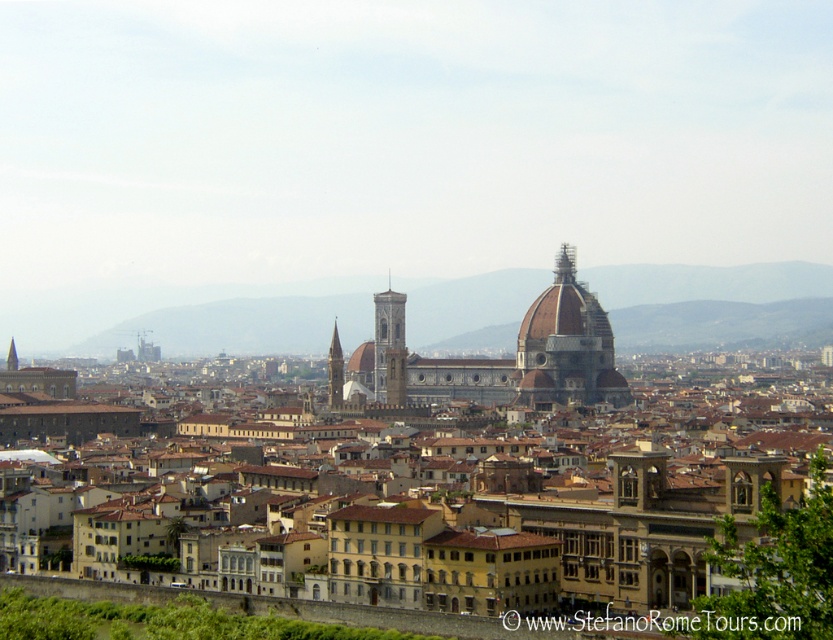
Between point (530, 378) and point (392, 360), which one is positioned in front?

Point (530, 378) is in front.

Between matte gray dome at center and smooth stone bell tower at center, which one has less height?

smooth stone bell tower at center is shorter.

Is point (582, 381) farther from viewer compared to point (393, 333)?

No, it is in front of (393, 333).

Identify the location of matte gray dome at center. (566, 346).

How much distance is there between smooth stone bell tower at center and smooth stone tower at center?

smooth stone bell tower at center is 21.16 meters away from smooth stone tower at center.

Where is `smooth stone bell tower at center`? Image resolution: width=833 pixels, height=640 pixels. smooth stone bell tower at center is located at coordinates 388,348.

Who is shorter, matte gray dome at center or smooth stone tower at center?

With less height is smooth stone tower at center.

Does matte gray dome at center appear under smooth stone tower at center?

No, matte gray dome at center is not below smooth stone tower at center.

Identify the location of matte gray dome at center. (566, 346).

What are the coordinates of `matte gray dome at center` in the screenshot? It's located at 566,346.